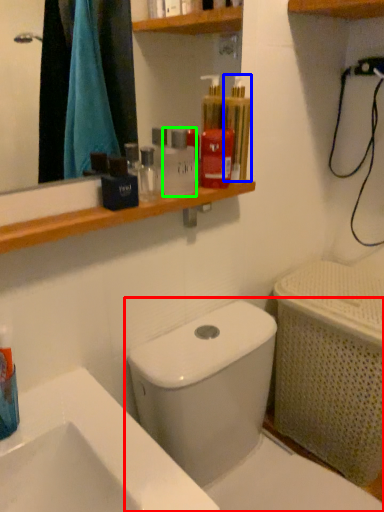
Question: Which object is the farthest from toilet (highlighted by a red box)? Choose among these: mouthwash (highlighted by a blue box) or mouthwash (highlighted by a green box).

Choices:
 (A) mouthwash
 (B) mouthwash

Answer: (A)